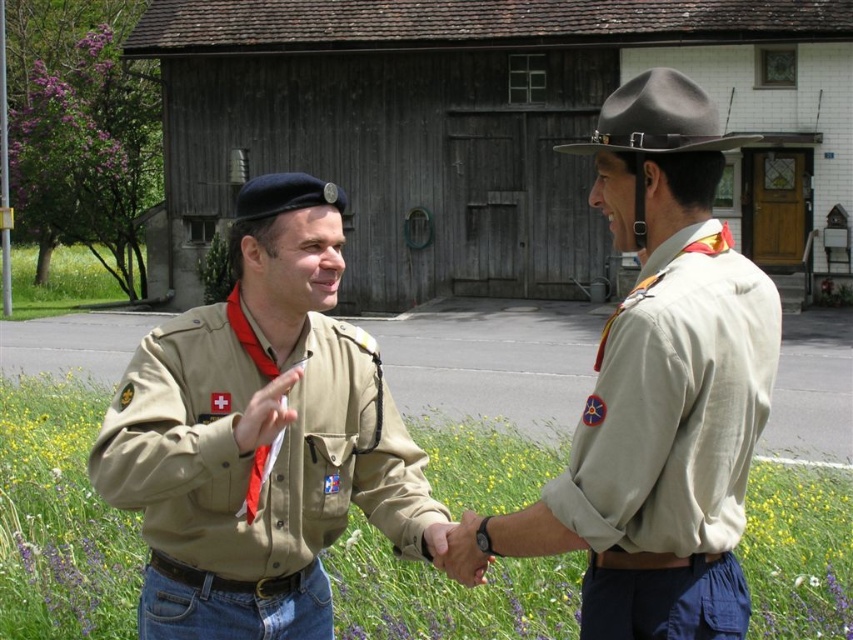
Question: Can you confirm if khaki uniform at center is positioned to the right of gray felt cowboy hat at upper center?

Choices:
 (A) no
 (B) yes

Answer: (A)

Question: Is smooth leather hand at center positioned before matte khaki shirt at center?

Choices:
 (A) no
 (B) yes

Answer: (A)

Question: Estimate the real-world distances between objects in this image. Which object is farther from the smooth leather hand at center?

Choices:
 (A) brown felt cowboy hat at upper center
 (B) matte khaki shirt at center

Answer: (A)

Question: Which object is closer to the camera taking this photo?

Choices:
 (A) smooth leather hand at center
 (B) brown felt cowboy hat at upper center

Answer: (B)

Question: Can you confirm if tan uniform at center is positioned above khaki uniform at center?

Choices:
 (A) yes
 (B) no

Answer: (B)

Question: Which point appears closest to the camera in this image?

Choices:
 (A) (662, 118)
 (B) (460, 582)

Answer: (A)